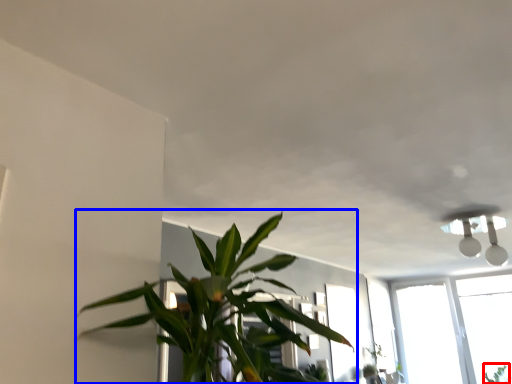
Question: Which of the following is the closest to the observer, plant (highlighted by a red box) or houseplant (highlighted by a blue box)?

Choices:
 (A) plant
 (B) houseplant

Answer: (B)